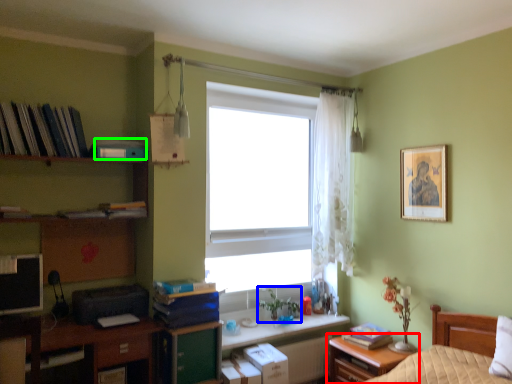
Question: Considering the real-world distances, which object is farthest from nightstand (highlighted by a red box)? plant (highlighted by a blue box) or book (highlighted by a green box)?

Choices:
 (A) plant
 (B) book

Answer: (B)